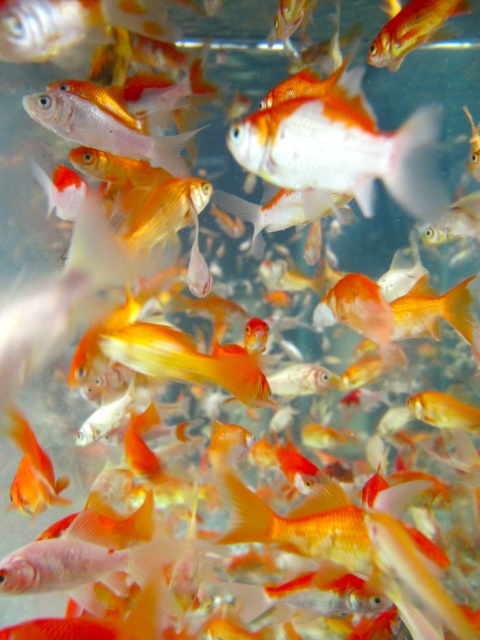
Measure the distance between point (358,172) and camera.

They are 3.95 feet apart.

At what (x,y) coordinates should I click in order to perform the action: click on shiny orange fish at center. Please return your answer as a coordinate pair (x, y). Looking at the image, I should click on (343, 150).